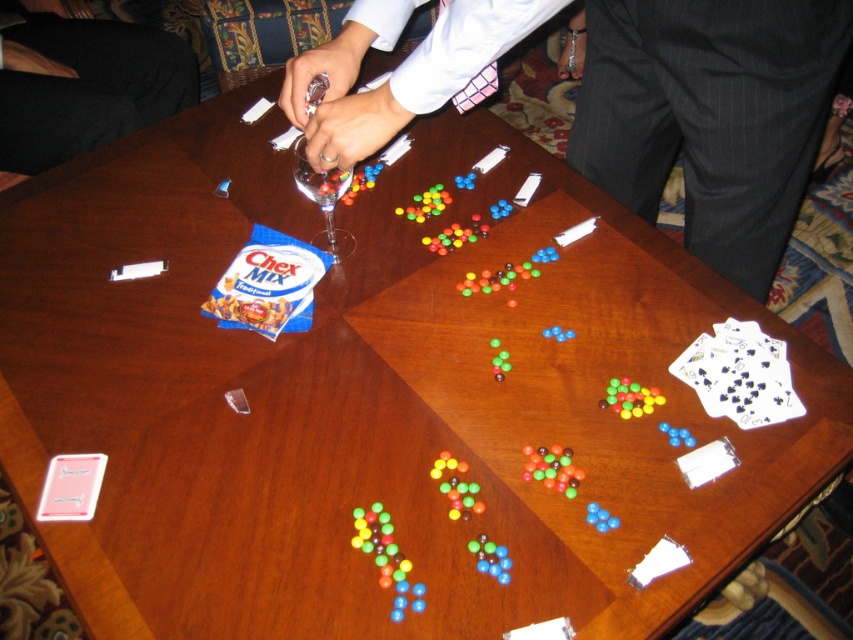
You are a photographer trying to take a picture of the white paper cards at lower right. The camera you are holding is 35.58 inches away from the cards. Is the distance sufficient to capture the entire cards in the frame?

The white paper cards at lower right and camera are 35.58 inches apart from each other. The distance is sufficient to capture the entire cards in the frame as they are positioned at that exact distance.

You are a child playing with the shiny multicolored candies at center and the translucent plastic beads at bottom center on the table. You want to reach the beads without moving the candies. Is it possible to do so?

The translucent plastic beads at bottom center are behind the shiny multicolored candies at center, so you can reach them without moving the candies by going around the candies.

You are playing a card game with friends at the table. You need to place a new card next to the shiny multicolored candies at center. Where should you place it so that it doesn not overlap with the white paper cards at lower right?

Since the white paper cards at lower right are wider than the shiny multicolored candies at center, you should place the new card to the left side of the shiny multicolored candies at center to avoid overlapping with the wider white paper cards at lower right.